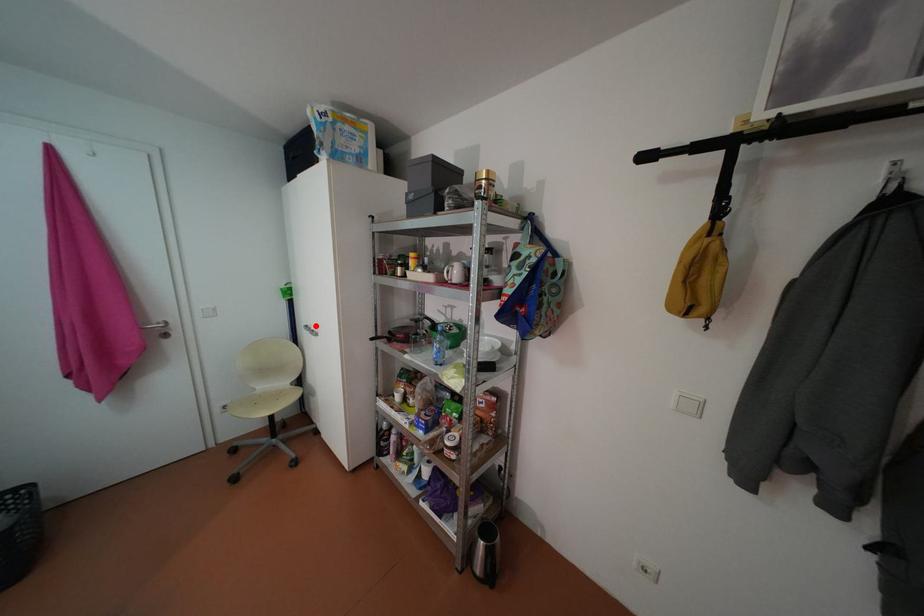
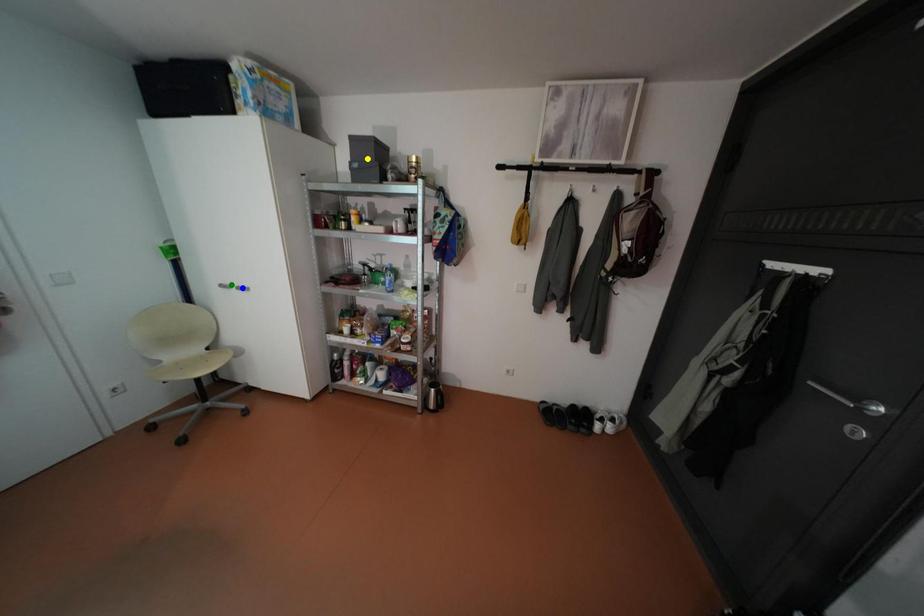
Question: I am providing you with two images of the same scene from different viewpoints. A red point is marked on the first image. You are given multiple points on the second image. In image 2, which mark is for the same physical point as the one in image 1?

Choices:
 (A) yellow point
 (B) green point
 (C) blue point

Answer: (B)